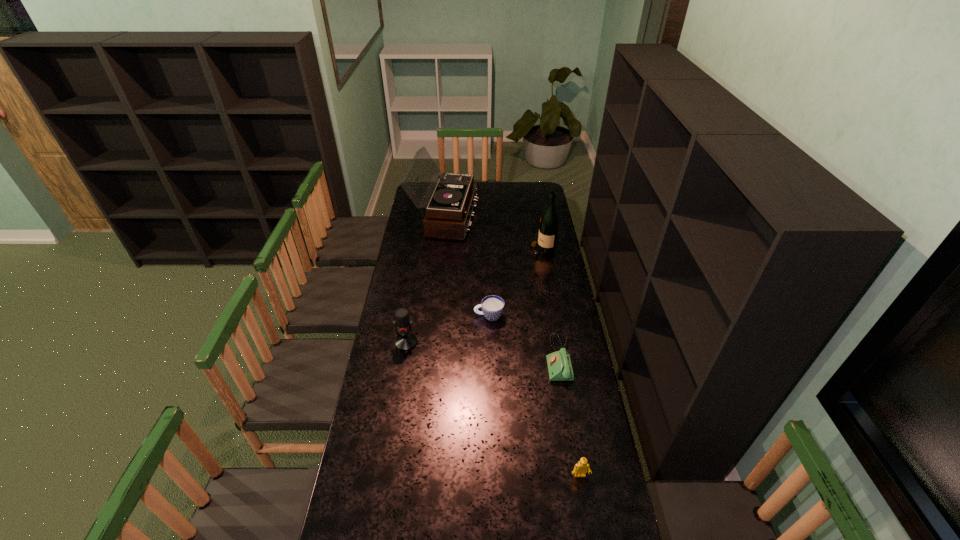
The width and height of the screenshot is (960, 540). Identify the location of free space located 0.260m on the surface of the second farthest object. (481, 251).

Where is `vacant space situated on the side of the microphone with the red ring`? This screenshot has height=540, width=960. vacant space situated on the side of the microphone with the red ring is located at coordinates (391, 440).

Locate an element on the screen. This screenshot has height=540, width=960. vacant area situated 0.100m on the face of the nearest object is located at coordinates (587, 512).

I want to click on vacant region located on the side of the third farthest object with the handle, so click(x=430, y=316).

Find the location of a particular element. vacant region located 0.260m on the side of the third farthest object with the handle is located at coordinates (417, 316).

I want to click on free space located 0.230m on the side of the third farthest object with the handle, so click(x=423, y=316).

I want to click on vacant space located 0.270m on the dial of the telephone, so click(x=480, y=358).

The image size is (960, 540). Find the location of `free space located on the dial of the telephone`. free space located on the dial of the telephone is located at coordinates (480, 358).

Where is `free space located on the dial of the telephone`? free space located on the dial of the telephone is located at coordinates (521, 358).

Locate an element on the screen. object positioned at the far edge is located at coordinates (448, 213).